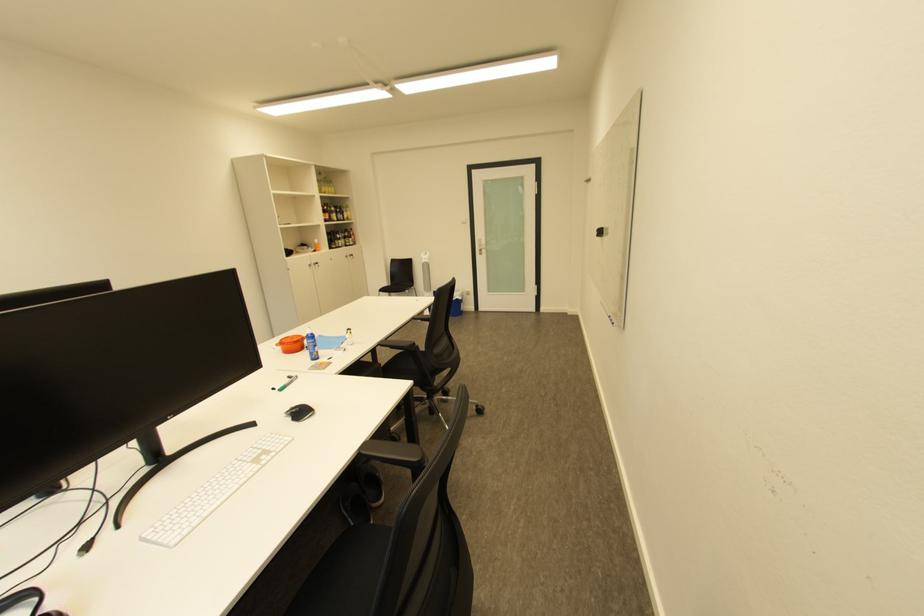
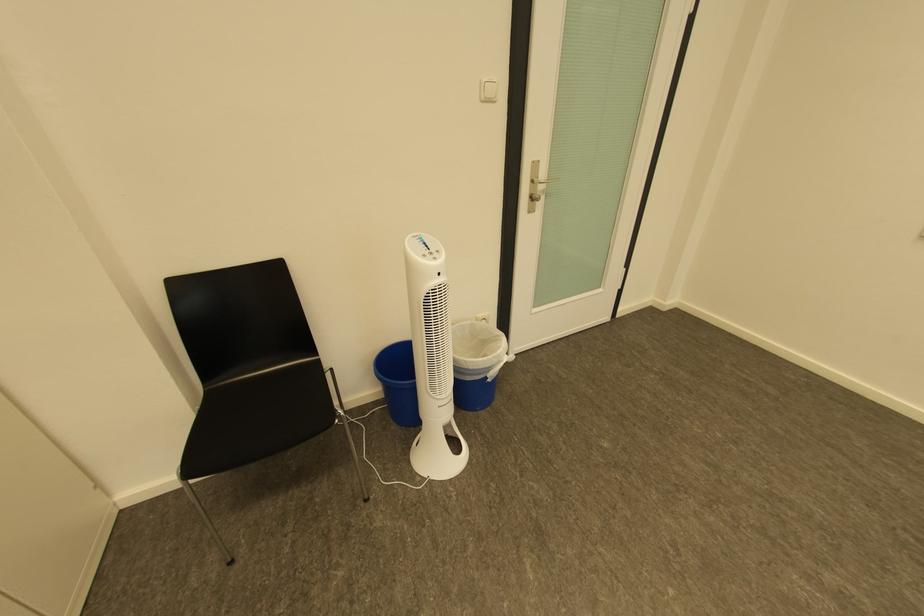
The point at (490,246) is marked in the first image. Where is the corresponding point in the second image?

(541, 182)